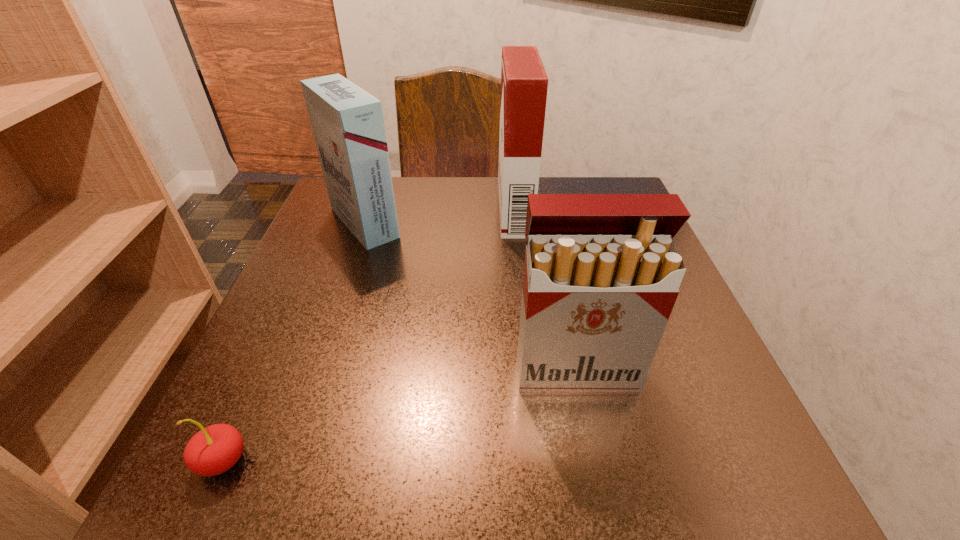
At what (x,y) coordinates should I click in order to perform the action: click on free space between the cherry and the leftmost cigarette case. Please return your answer as a coordinate pair (x, y). Looking at the image, I should click on (294, 342).

At what (x,y) coordinates should I click in order to perform the action: click on empty location between the nearest object and the second nearest object. Please return your answer as a coordinate pair (x, y). Looking at the image, I should click on (399, 415).

Find the location of `free space between the leftmost cigarette case and the third farthest object`. free space between the leftmost cigarette case and the third farthest object is located at coordinates (470, 296).

At what (x,y) coordinates should I click in order to perform the action: click on free spot between the nearest object and the leftmost cigarette case. Please return your answer as a coordinate pair (x, y). Looking at the image, I should click on (294, 342).

Where is `vacant area that lies between the leftmost cigarette case and the nearest cigarette case`? This screenshot has height=540, width=960. vacant area that lies between the leftmost cigarette case and the nearest cigarette case is located at coordinates (470, 296).

Select which object is the closest to the nearest cigarette case. Please provide its 2D coordinates. Your answer should be formatted as a tuple, i.e. [(x, y)], where the tuple contains the x and y coordinates of a point satisfying the conditions above.

[(524, 83)]

Point out which object is positioned as the second nearest to the nearest object. Please provide its 2D coordinates. Your answer should be formatted as a tuple, i.e. [(x, y)], where the tuple contains the x and y coordinates of a point satisfying the conditions above.

[(347, 122)]

Find the location of a particular element. The image size is (960, 540). the third closest cigarette case relative to the shortest object is located at coordinates (524, 83).

In order to click on cigarette case that can be found as the third closest to the shortest object in this screenshot , I will do `click(524, 83)`.